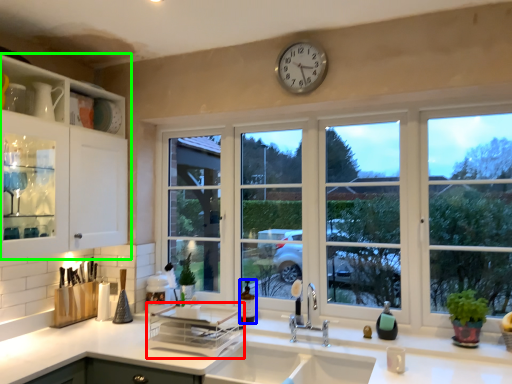
Question: Which object is positioned farthest from appliance (highlighted by a red box)? Select from bottle (highlighted by a blue box) and cabinetry (highlighted by a green box).

Choices:
 (A) bottle
 (B) cabinetry

Answer: (B)